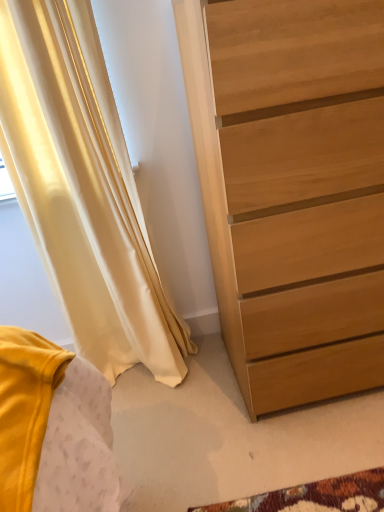
Locate an element on the screen. The width and height of the screenshot is (384, 512). satin yellow curtain at left is located at coordinates (83, 190).

What do you see at coordinates (83, 190) in the screenshot? The height and width of the screenshot is (512, 384). I see `satin yellow curtain at left` at bounding box center [83, 190].

The height and width of the screenshot is (512, 384). What do you see at coordinates (292, 189) in the screenshot?
I see `light brown wood chest of drawers at right` at bounding box center [292, 189].

What are the coordinates of `light brown wood chest of drawers at right` in the screenshot? It's located at (292, 189).

Identify the location of satin yellow curtain at left. (83, 190).

Which is more to the left, satin yellow curtain at left or light brown wood chest of drawers at right?

Positioned to the left is satin yellow curtain at left.

Is satin yellow curtain at left positioned before light brown wood chest of drawers at right?

No, it is not.

Which is closer to the camera, (x=135, y=187) or (x=303, y=26)?

Point (x=135, y=187) is positioned farther from the camera compared to point (x=303, y=26).

From the image's perspective, is satin yellow curtain at left beneath light brown wood chest of drawers at right?

Yes, from the image's perspective, satin yellow curtain at left is below light brown wood chest of drawers at right.

From a real-world perspective, between satin yellow curtain at left and light brown wood chest of drawers at right, who is vertically lower?

From a 3D spatial view, light brown wood chest of drawers at right is below.

Looking at their sizes, would you say satin yellow curtain at left is wider or thinner than light brown wood chest of drawers at right?

Clearly, satin yellow curtain at left has less width compared to light brown wood chest of drawers at right.

In terms of height, does satin yellow curtain at left look taller or shorter compared to light brown wood chest of drawers at right?

Considering their sizes, satin yellow curtain at left has more height than light brown wood chest of drawers at right.

Is satin yellow curtain at left bigger or smaller than light brown wood chest of drawers at right?

In the image, satin yellow curtain at left appears to be smaller than light brown wood chest of drawers at right.

Looking at this image, could light brown wood chest of drawers at right be considered to be inside satin yellow curtain at left?

No, light brown wood chest of drawers at right is not surrounded by satin yellow curtain at left.

Consider the image. Are satin yellow curtain at left and light brown wood chest of drawers at right beside each other?

satin yellow curtain at left is not next to light brown wood chest of drawers at right, and they're not touching.

Is satin yellow curtain at left oriented towards light brown wood chest of drawers at right?

No, satin yellow curtain at left is not aimed at light brown wood chest of drawers at right.

How different are the orientations of satin yellow curtain at left and light brown wood chest of drawers at right in degrees?

The angle between the facing direction of satin yellow curtain at left and the facing direction of light brown wood chest of drawers at right is 4.19e-05 degrees.

This screenshot has width=384, height=512. Identify the location of chest of drawers above the satin yellow curtain at left (from the image's perspective). (292, 189).

Considering the positions of objects light brown wood chest of drawers at right and satin yellow curtain at left in the image provided, who is more to the left, light brown wood chest of drawers at right or satin yellow curtain at left?

Positioned to the left is satin yellow curtain at left.

Which object is further away from the camera taking this photo, light brown wood chest of drawers at right or satin yellow curtain at left?

satin yellow curtain at left is more distant.

Is point (244, 220) positioned after point (8, 34)?

No.

In the scene shown: From the image's perspective, which is above, light brown wood chest of drawers at right or satin yellow curtain at left?

From the image's view, light brown wood chest of drawers at right is above.

From a real-world perspective, is light brown wood chest of drawers at right under satin yellow curtain at left?

Correct, in the physical world, light brown wood chest of drawers at right is lower than satin yellow curtain at left.

Does light brown wood chest of drawers at right have a lesser width compared to satin yellow curtain at left?

Incorrect, the width of light brown wood chest of drawers at right is not less than that of satin yellow curtain at left.

Considering the relative sizes of light brown wood chest of drawers at right and satin yellow curtain at left in the image provided, is light brown wood chest of drawers at right shorter than satin yellow curtain at left?

Indeed, light brown wood chest of drawers at right has a lesser height compared to satin yellow curtain at left.

Is light brown wood chest of drawers at right bigger than satin yellow curtain at left?

Correct, light brown wood chest of drawers at right is larger in size than satin yellow curtain at left.

Is light brown wood chest of drawers at right positioned beyond the bounds of satin yellow curtain at left?

Yes, light brown wood chest of drawers at right is not within satin yellow curtain at left.

Are light brown wood chest of drawers at right and satin yellow curtain at left beside each other?

No, light brown wood chest of drawers at right is not next to satin yellow curtain at left.

Is light brown wood chest of drawers at right aimed at satin yellow curtain at left?

No, light brown wood chest of drawers at right is not aimed at satin yellow curtain at left.

How much distance is there between light brown wood chest of drawers at right and satin yellow curtain at left?

The distance of light brown wood chest of drawers at right from satin yellow curtain at left is 19.43 inches.

I want to click on curtain that is behind the light brown wood chest of drawers at right, so click(x=83, y=190).

You are a GUI agent. You are given a task and a screenshot of the screen. Output one action in this format:
    pyautogui.click(x=<x>, y=<y>)
    Task: Click on the chest of drawers on the right of satin yellow curtain at left
    This screenshot has height=512, width=384.
    Given the screenshot: What is the action you would take?
    pyautogui.click(x=292, y=189)

In order to click on curtain behind the light brown wood chest of drawers at right in this screenshot , I will do `click(83, 190)`.